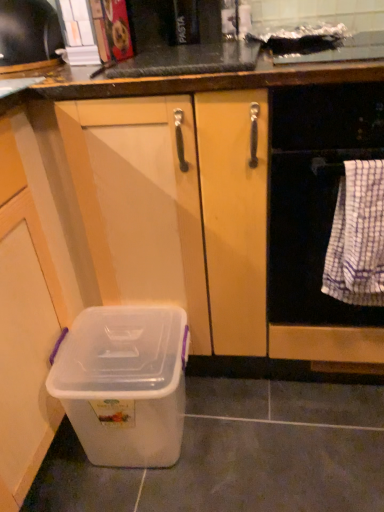
Question: Is transparent plastic storage box at lower left placed right next to white woven towel at right?

Choices:
 (A) yes
 (B) no

Answer: (B)

Question: Is white woven towel at right at the back of transparent plastic storage box at lower left?

Choices:
 (A) no
 (B) yes

Answer: (A)

Question: From a real-world perspective, is transparent plastic storage box at lower left positioned under white woven towel at right based on gravity?

Choices:
 (A) yes
 (B) no

Answer: (A)

Question: From the image's perspective, does transparent plastic storage box at lower left appear lower than white woven towel at right?

Choices:
 (A) yes
 (B) no

Answer: (A)

Question: Is transparent plastic storage box at lower left oriented towards white woven towel at right?

Choices:
 (A) no
 (B) yes

Answer: (A)

Question: Is transparent plastic storage box at lower left shorter than white woven towel at right?

Choices:
 (A) no
 (B) yes

Answer: (B)

Question: Considering the relative sizes of white woven towel at right and metallic silver toaster at upper left in the image provided, is white woven towel at right shorter than metallic silver toaster at upper left?

Choices:
 (A) no
 (B) yes

Answer: (A)

Question: Can you confirm if white woven towel at right is taller than metallic silver toaster at upper left?

Choices:
 (A) no
 (B) yes

Answer: (B)

Question: Is white woven towel at right not near metallic silver toaster at upper left?

Choices:
 (A) no
 (B) yes

Answer: (A)

Question: From the image's perspective, does white woven towel at right appear higher than metallic silver toaster at upper left?

Choices:
 (A) yes
 (B) no

Answer: (B)

Question: Considering the relative positions of white woven towel at right and metallic silver toaster at upper left in the image provided, is white woven towel at right to the left of metallic silver toaster at upper left from the viewer's perspective?

Choices:
 (A) yes
 (B) no

Answer: (B)

Question: Are white woven towel at right and metallic silver toaster at upper left beside each other?

Choices:
 (A) no
 (B) yes

Answer: (A)

Question: Is metallic silver toaster at upper left wider than transparent plastic storage box at lower left?

Choices:
 (A) no
 (B) yes

Answer: (A)